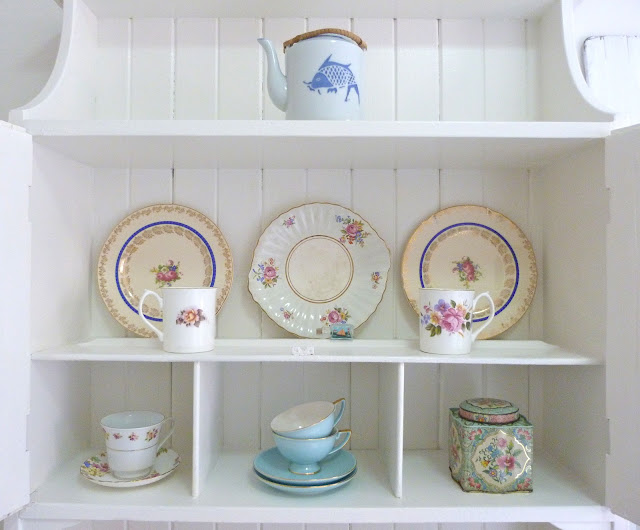
You are a GUI agent. You are given a task and a screenshot of the screen. Output one action in this format:
    pyautogui.click(x=<x>, y=<y>)
    Task: Click on the floral cups
    This screenshot has width=640, height=530.
    Given the screenshot: What is the action you would take?
    pyautogui.click(x=124, y=440), pyautogui.click(x=182, y=318), pyautogui.click(x=442, y=321)